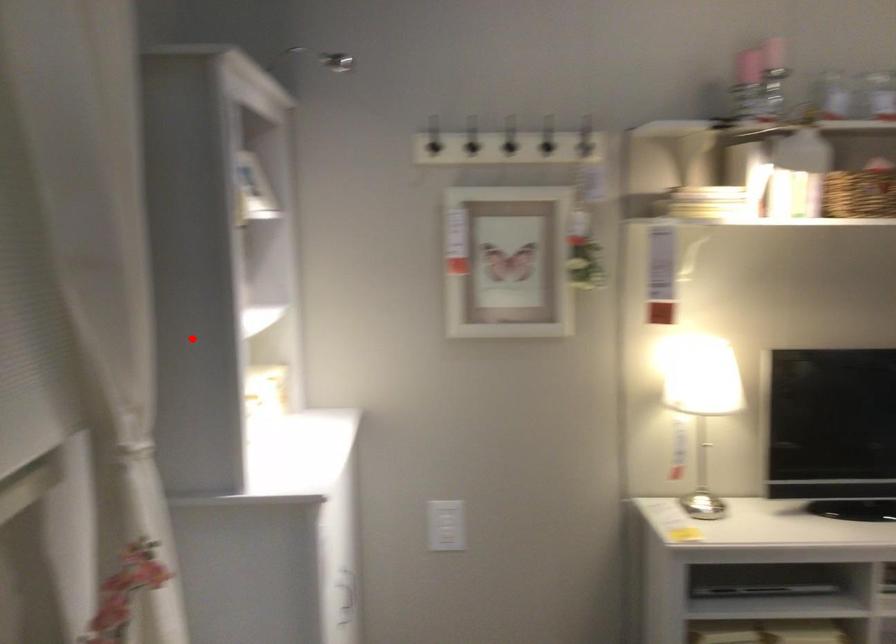
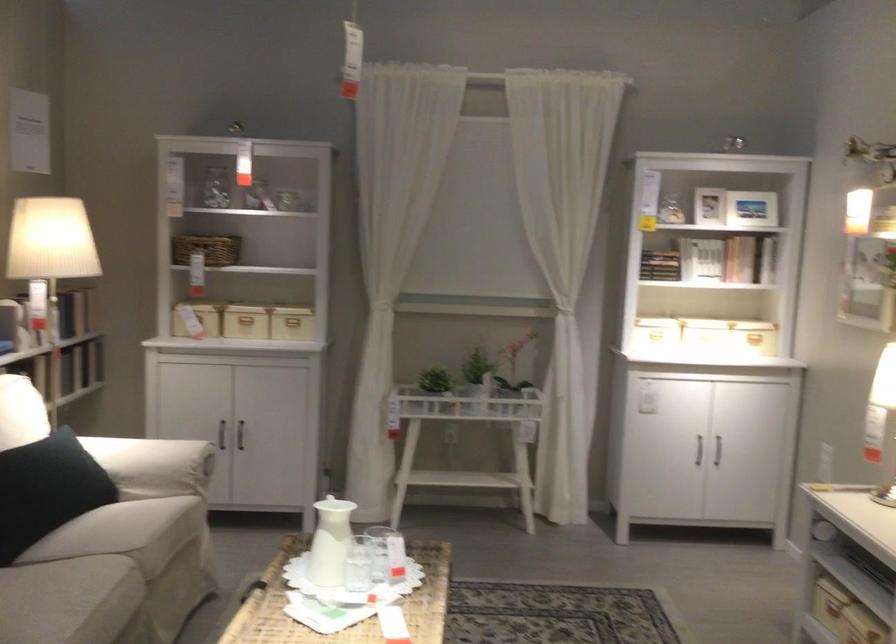
Find the pixel in the second image that matches the highlighted location in the first image.

(659, 265)